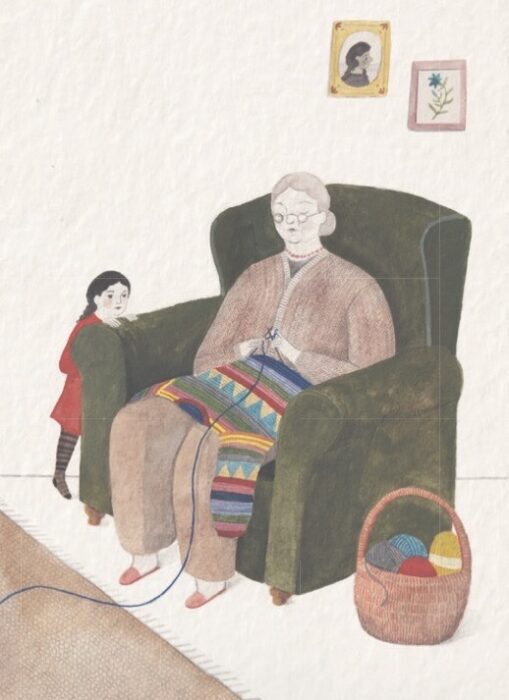
You are a GUI agent. You are given a task and a screenshot of the screen. Output one action in this format:
    pyautogui.click(x=<x>, y=<y>)
    Task: Click on the rug
    
    Given the screenshot: What is the action you would take?
    pyautogui.click(x=140, y=640)